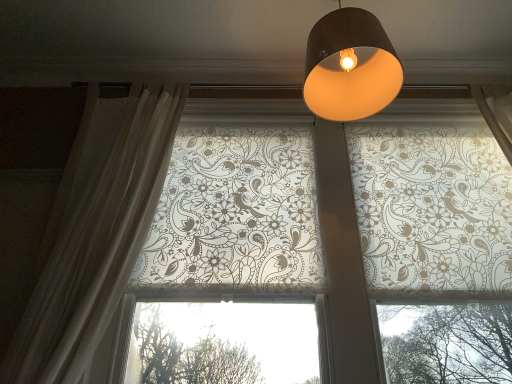
The height and width of the screenshot is (384, 512). What do you see at coordinates (350, 69) in the screenshot?
I see `matte black lampshade at upper center` at bounding box center [350, 69].

Image resolution: width=512 pixels, height=384 pixels. What do you see at coordinates (97, 236) in the screenshot? I see `sheer white curtain at left` at bounding box center [97, 236].

This screenshot has height=384, width=512. In order to click on translucent floral-patterned roller blinds at upper center in this screenshot , I will do `click(236, 214)`.

I want to click on matte black lampshade at upper center, so click(x=350, y=69).

Considering the positions of points (45, 276) and (509, 194), is point (45, 276) farther from camera compared to point (509, 194)?

No.

Is translucent floral-patterned roller blinds at upper center a part of sheer white curtain at left?

No, translucent floral-patterned roller blinds at upper center is located outside of sheer white curtain at left.

Who is taller, sheer white curtain at left or translucent floral-patterned roller blinds at upper center?

sheer white curtain at left is taller.

Can you tell me how much sheer white curtain at left and translucent floral-patterned roller blinds at upper center differ in facing direction?

sheer white curtain at left and translucent floral-patterned roller blinds at upper center are facing 4.86e-05 degrees away from each other.

Considering the relative positions of translucent floral-patterned roller blinds at upper center and matte black lampshade at upper center in the image provided, is translucent floral-patterned roller blinds at upper center to the right of matte black lampshade at upper center from the viewer's perspective?

Correct, you'll find translucent floral-patterned roller blinds at upper center to the right of matte black lampshade at upper center.

Does point (476, 170) appear closer or farther from the camera than point (327, 30)?

Point (476, 170) is positioned farther from the camera compared to point (327, 30).

From a real-world perspective, is translucent floral-patterned roller blinds at upper center above or below matte black lampshade at upper center?

Clearly, from a real-world perspective, translucent floral-patterned roller blinds at upper center is below matte black lampshade at upper center.

Locate an element on the screen. lamp located above the translucent floral-patterned roller blinds at upper center (from the image's perspective) is located at coordinates (350, 69).

Would you say matte black lampshade at upper center is part of sheer white curtain at left's contents?

Definitely not — matte black lampshade at upper center is not inside sheer white curtain at left.

Does point (38, 370) come behind point (351, 116)?

No.

Can you confirm if sheer white curtain at left is positioned to the left of matte black lampshade at upper center?

Indeed, sheer white curtain at left is positioned on the left side of matte black lampshade at upper center.

In the image, is matte black lampshade at upper center positioned in front of or behind sheer white curtain at left?

matte black lampshade at upper center is positioned farther from the viewer than sheer white curtain at left.

Is matte black lampshade at upper center completely or partially outside of sheer white curtain at left?

matte black lampshade at upper center is positioned outside sheer white curtain at left.

Is matte black lampshade at upper center turned away from sheer white curtain at left?

No, sheer white curtain at left is not at the back of matte black lampshade at upper center.

Who is shorter, matte black lampshade at upper center or translucent floral-patterned roller blinds at upper center?

matte black lampshade at upper center is shorter.

Can you confirm if matte black lampshade at upper center is wider than translucent floral-patterned roller blinds at upper center?

Correct, the width of matte black lampshade at upper center exceeds that of translucent floral-patterned roller blinds at upper center.

Does matte black lampshade at upper center have a larger size compared to translucent floral-patterned roller blinds at upper center?

No.

How different are the orientations of matte black lampshade at upper center and translucent floral-patterned roller blinds at upper center in degrees?

0.706 degrees separate the facing orientations of matte black lampshade at upper center and translucent floral-patterned roller blinds at upper center.

Does translucent floral-patterned roller blinds at upper center have a smaller size compared to sheer white curtain at left?

Incorrect, translucent floral-patterned roller blinds at upper center is not smaller in size than sheer white curtain at left.

From a real-world perspective, is translucent floral-patterned roller blinds at upper center on top of sheer white curtain at left?

No.

Between point (215, 149) and point (49, 303), which one is positioned behind?

The point (215, 149) is farther from the camera.

Find the location of `bay window that is under the sheer white curtain at left (from a real-world perspective)`. bay window that is under the sheer white curtain at left (from a real-world perspective) is located at coordinates (236, 214).

Locate an element on the screen. Image resolution: width=512 pixels, height=384 pixels. lamp above the translucent floral-patterned roller blinds at upper center (from a real-world perspective) is located at coordinates (350, 69).

Considering their positions, is matte black lampshade at upper center positioned further to translucent floral-patterned roller blinds at upper center than sheer white curtain at left?

The object further to translucent floral-patterned roller blinds at upper center is matte black lampshade at upper center.

Which object lies further to the anchor point sheer white curtain at left, matte black lampshade at upper center or translucent floral-patterned roller blinds at upper center?

matte black lampshade at upper center lies further to sheer white curtain at left than the other object.

From the image, which object appears to be nearer to matte black lampshade at upper center, sheer white curtain at left or translucent floral-patterned roller blinds at upper center?

The object closer to matte black lampshade at upper center is translucent floral-patterned roller blinds at upper center.

When comparing their distances from matte black lampshade at upper center, does translucent floral-patterned roller blinds at upper center or sheer white curtain at left seem closer?

Among the two, translucent floral-patterned roller blinds at upper center is located nearer to matte black lampshade at upper center.

Based on their spatial positions, is translucent floral-patterned roller blinds at upper center or matte black lampshade at upper center further from sheer white curtain at left?

Based on the image, matte black lampshade at upper center appears to be further to sheer white curtain at left.

Estimate the real-world distances between objects in this image. Which object is closer to translucent floral-patterned roller blinds at upper center, sheer white curtain at left or matte black lampshade at upper center?

sheer white curtain at left lies closer to translucent floral-patterned roller blinds at upper center than the other object.

Locate an element on the screen. lamp situated between sheer white curtain at left and translucent floral-patterned roller blinds at upper center from left to right is located at coordinates (350, 69).